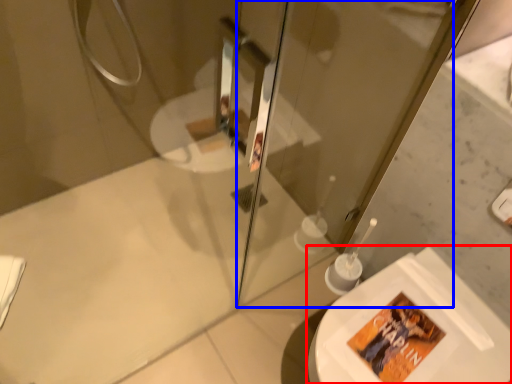
Question: Which point is closer to the camera, toilet (highlighted by a red box) or screen door (highlighted by a blue box)?

Choices:
 (A) toilet
 (B) screen door

Answer: (B)